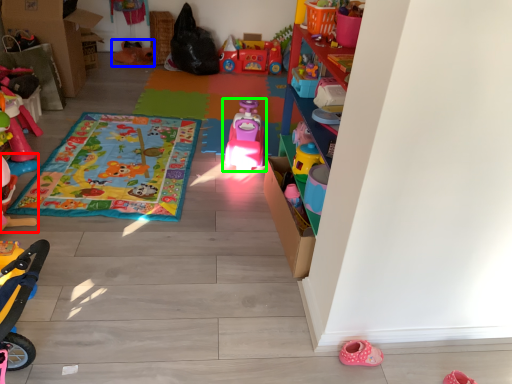
Question: Considering the real-world distances, which object is closest to toy (highlighted by a red box)? toy (highlighted by a blue box) or toy (highlighted by a green box).

Choices:
 (A) toy
 (B) toy

Answer: (B)